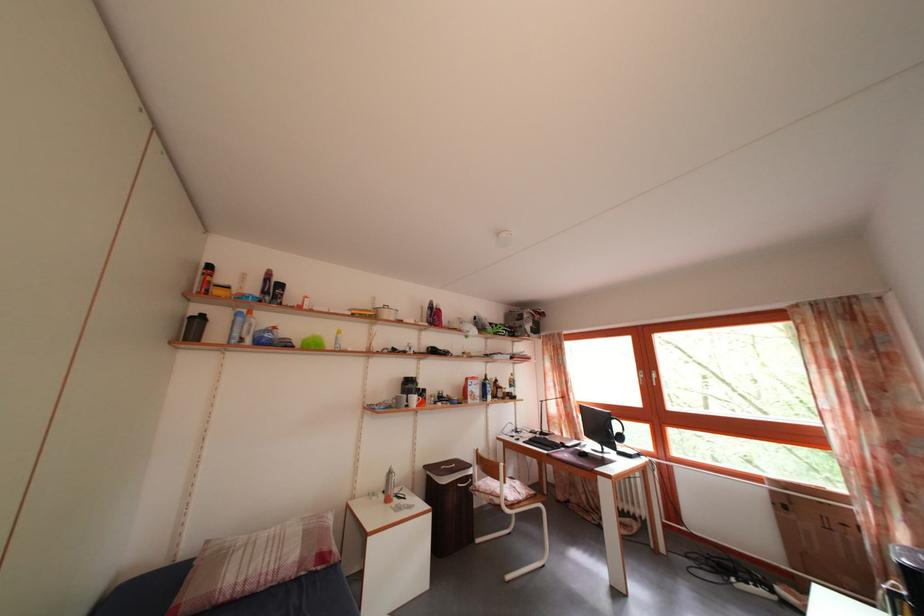
Where is `silver window handle`? The width and height of the screenshot is (924, 616). silver window handle is located at coordinates (652, 378).